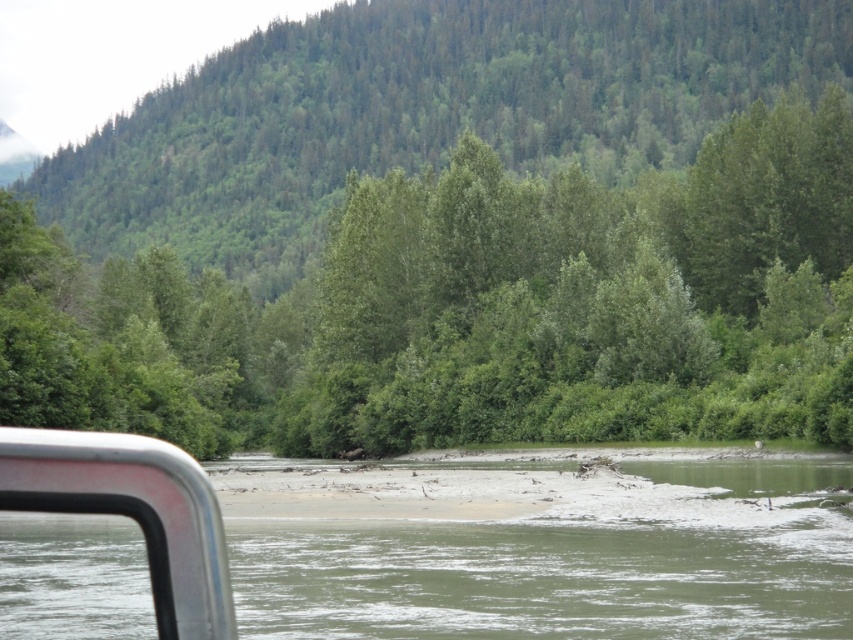
Does green leafy forest at upper center have a greater height compared to greenish-brown sediment at center?

Indeed, green leafy forest at upper center has a greater height compared to greenish-brown sediment at center.

Identify the location of green leafy forest at upper center. (457, 234).